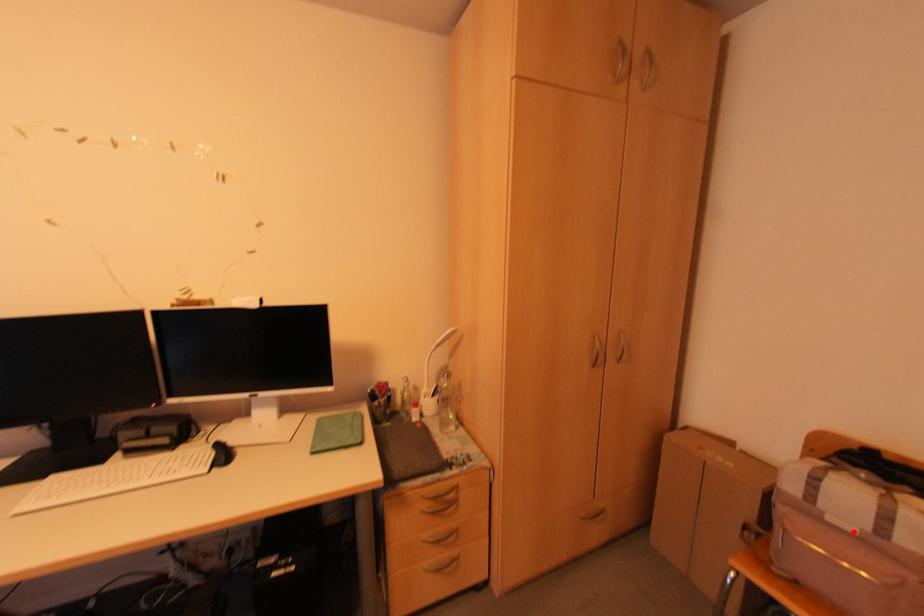
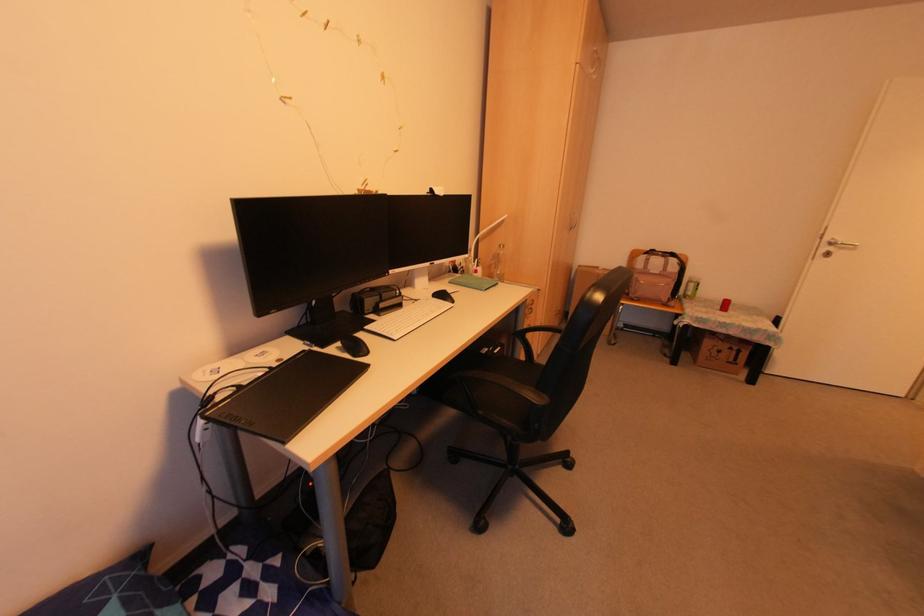
Question: A red point is marked in image1. In image2, is the corresponding 3D point closer to the camera or farther? Reply with the corresponding letter.

Choices:
 (A) The corresponding 3D point is closer.
 (B) The corresponding 3D point is farther.

Answer: (B)